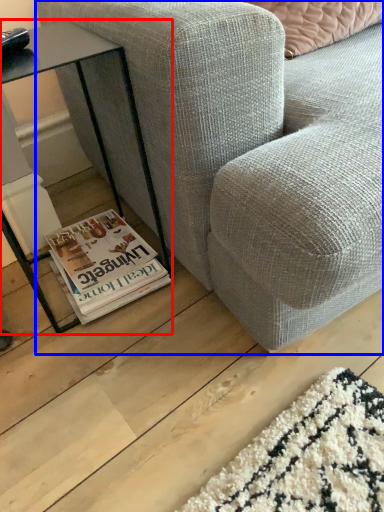
Question: Which object appears farthest to the camera in this image, table (highlighted by a red box) or studio couch (highlighted by a blue box)?

Choices:
 (A) table
 (B) studio couch

Answer: (A)